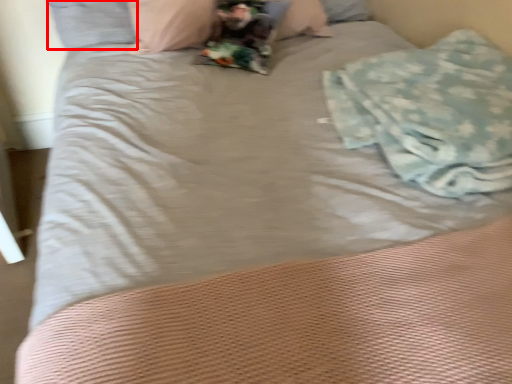
Question: Considering the relative positions of pillow (annotated by the red box) and material in the image provided, where is pillow (annotated by the red box) located with respect to the staircase?

Choices:
 (A) left
 (B) right

Answer: (A)